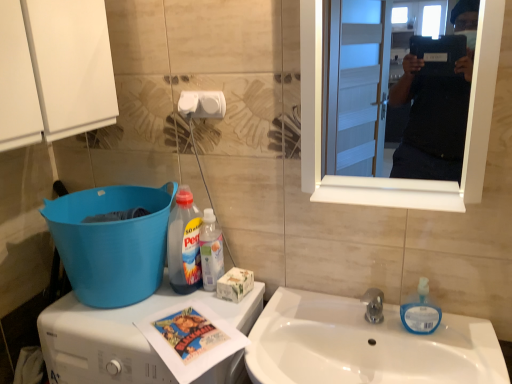
Find the location of `vacant space positioned to the left of white cardboard box at lower center`. vacant space positioned to the left of white cardboard box at lower center is located at coordinates (184, 303).